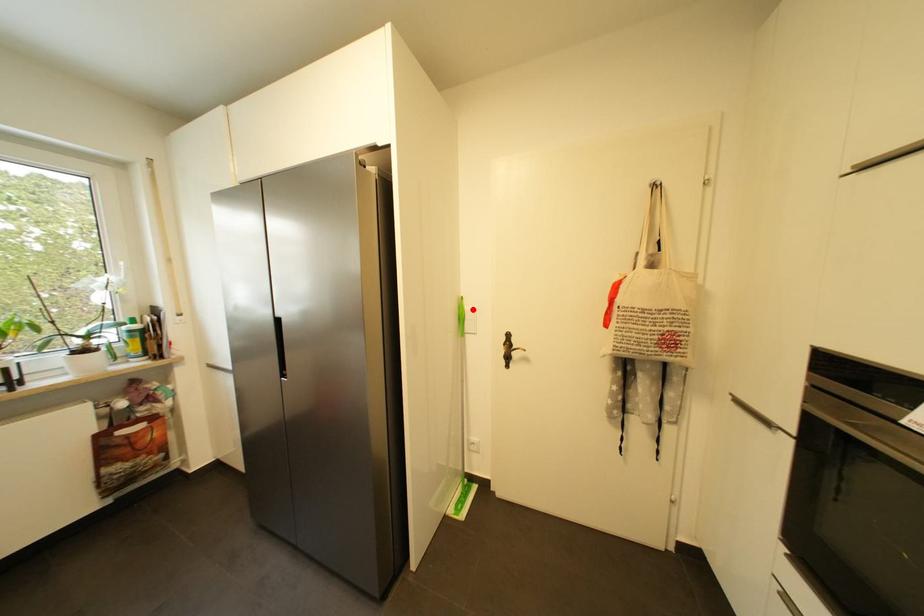
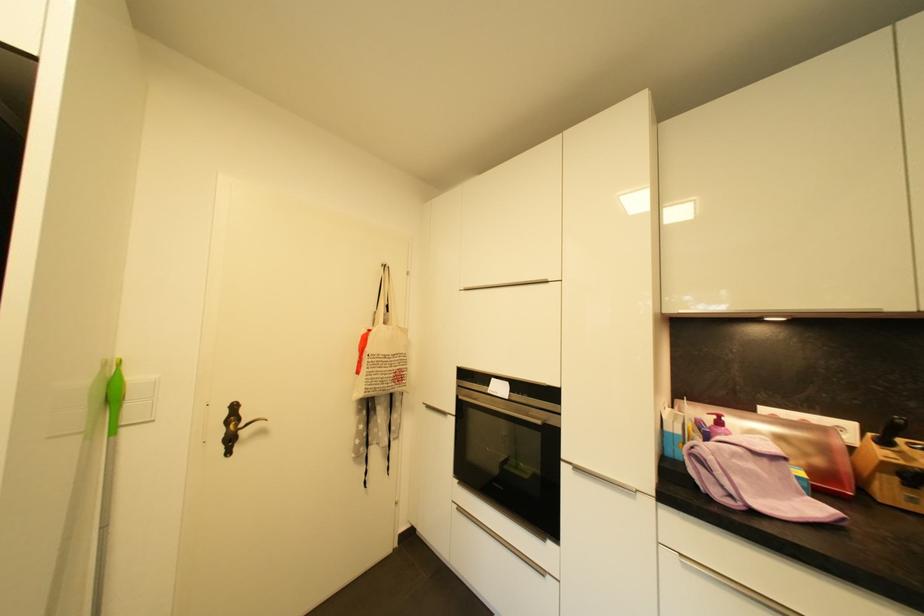
Where in the second image is the point corresponding to the highlighted location from the first image?

(138, 379)